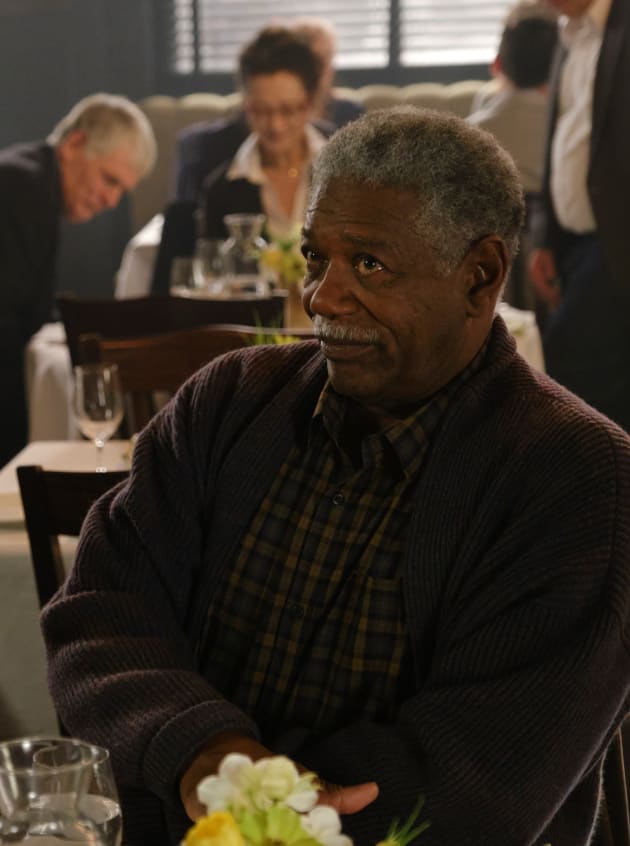
Image resolution: width=630 pixels, height=846 pixels. In order to click on beige couch seating in this screenshot , I will do coord(178,113).